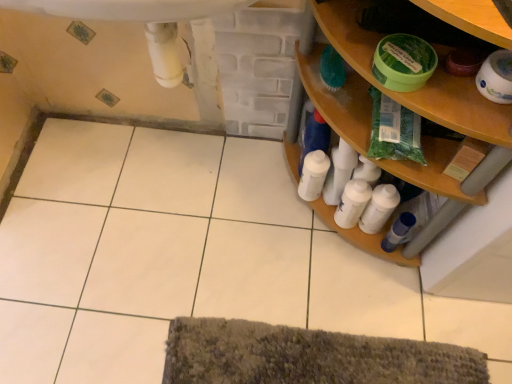
Question: From a real-world perspective, is white glossy bottle at lower right, the first toiletry when ordered from left to right, located higher than wooden shelf at right?

Choices:
 (A) no
 (B) yes

Answer: (A)

Question: Could wooden shelf at right be considered to be inside white glossy bottle at lower right, the first toiletry when ordered from left to right?

Choices:
 (A) yes
 (B) no

Answer: (B)

Question: Is there a large distance between white glossy bottle at lower right, the 3th toiletry viewed from the right, and wooden shelf at right?

Choices:
 (A) no
 (B) yes

Answer: (A)

Question: Is white glossy bottle at lower right, the first toiletry when ordered from left to right, smaller than wooden shelf at right?

Choices:
 (A) no
 (B) yes

Answer: (B)

Question: Would you say white glossy bottle at lower right, the 3th toiletry viewed from the right, is outside wooden shelf at right?

Choices:
 (A) yes
 (B) no

Answer: (B)

Question: Is white glossy toilet paper at upper right spatially inside white plastic sink at upper center, or outside of it?

Choices:
 (A) outside
 (B) inside

Answer: (A)

Question: Considering the positions of white glossy toilet paper at upper right and white plastic sink at upper center in the image, is white glossy toilet paper at upper right taller or shorter than white plastic sink at upper center?

Choices:
 (A) tall
 (B) short

Answer: (B)

Question: Is point (483, 66) closer or farther from the camera than point (198, 18)?

Choices:
 (A) closer
 (B) farther

Answer: (B)

Question: From the image's perspective, relative to white plastic sink at upper center, is white glossy toilet paper at upper right above or below?

Choices:
 (A) below
 (B) above

Answer: (A)

Question: Is white plastic sink at upper center taller or shorter than green plastic bag at upper right?

Choices:
 (A) tall
 (B) short

Answer: (A)

Question: From the image's perspective, relative to green plastic bag at upper right, is white plastic sink at upper center above or below?

Choices:
 (A) above
 (B) below

Answer: (A)

Question: From a real-world perspective, is white plastic sink at upper center above or below green plastic bag at upper right?

Choices:
 (A) above
 (B) below

Answer: (A)

Question: Is point (162, 71) closer or farther from the camera than point (404, 114)?

Choices:
 (A) farther
 (B) closer

Answer: (A)

Question: Is green plastic bag at upper right situated inside white glossy toilet paper at upper right or outside?

Choices:
 (A) inside
 (B) outside

Answer: (B)

Question: Considering the positions of green plastic bag at upper right and white glossy toilet paper at upper right in the image, is green plastic bag at upper right wider or thinner than white glossy toilet paper at upper right?

Choices:
 (A) thin
 (B) wide

Answer: (B)